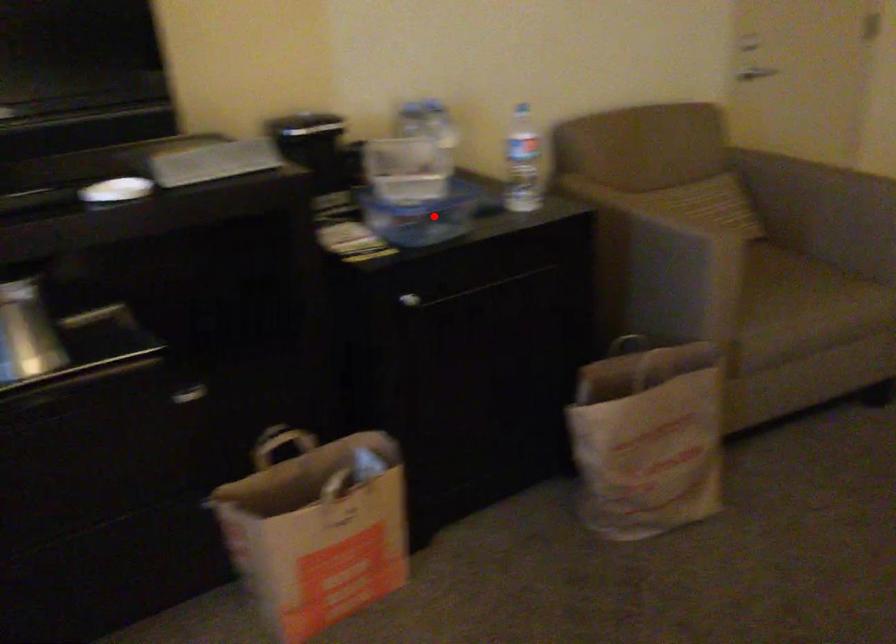
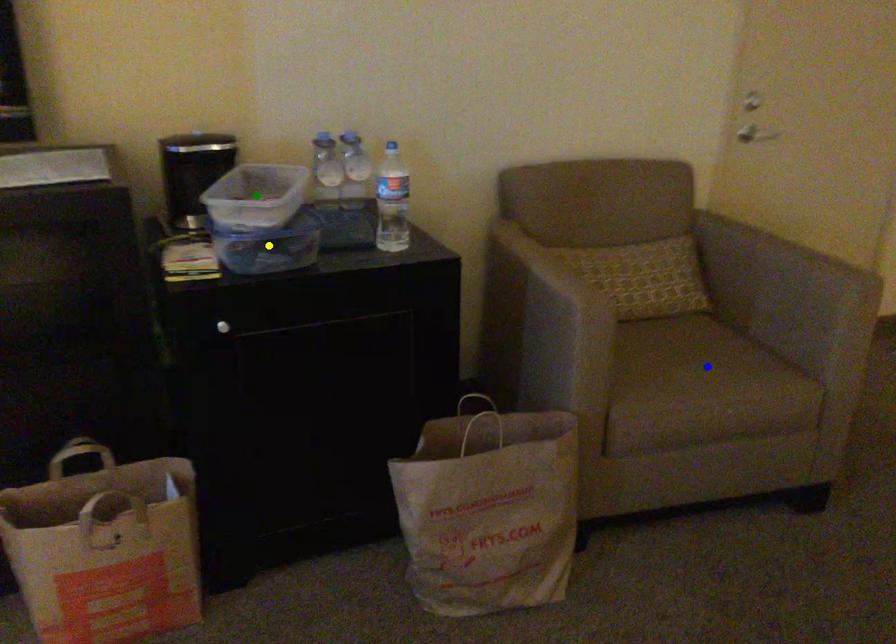
Question: I am providing you with two images of the same scene from different viewpoints. A red point is marked on the first image. You are given multiple points on the second image. Which point in image 2 is actually the same real-world point as the red point in image 1?

Choices:
 (A) blue point
 (B) yellow point
 (C) green point

Answer: (B)